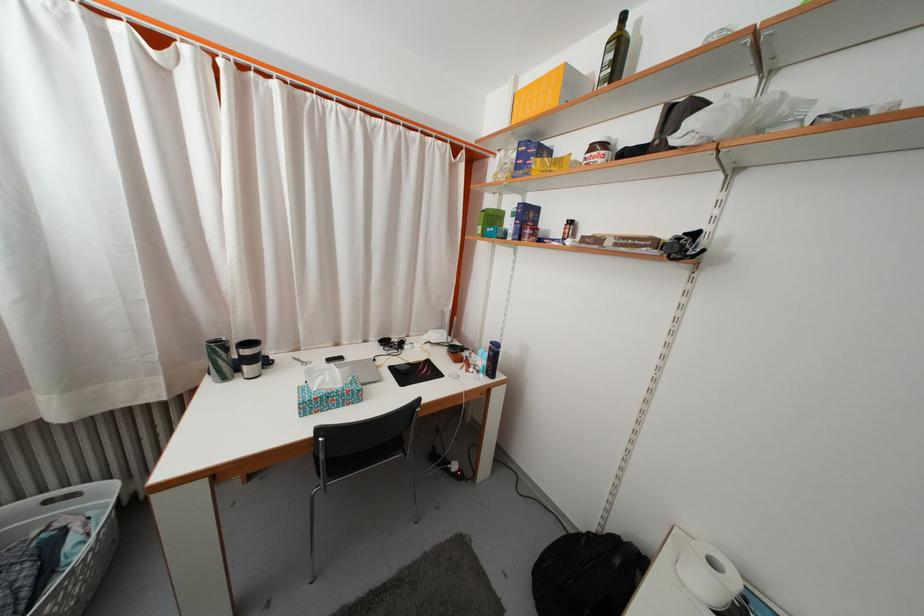
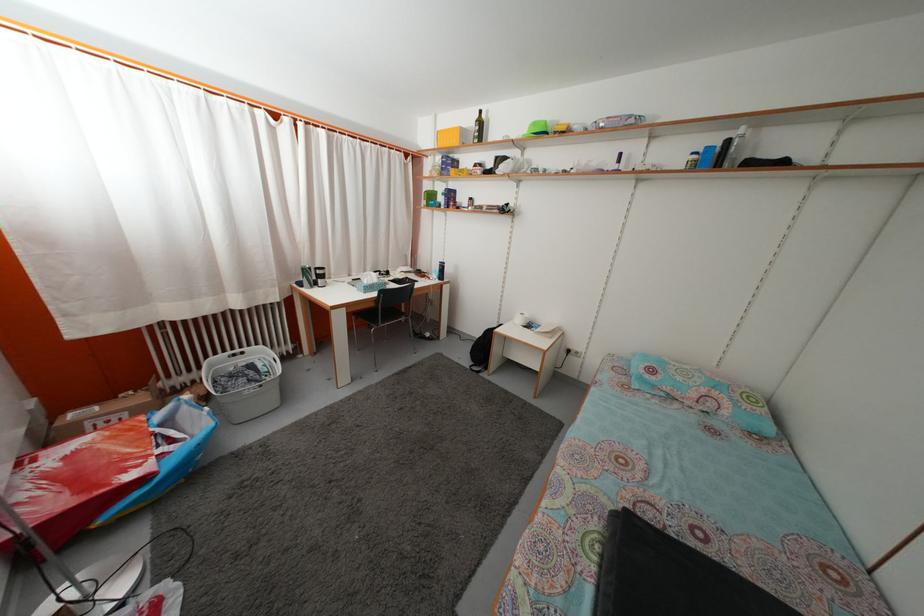
The point at (343, 352) is marked in the first image. Where is the corresponding point in the second image?

(355, 283)